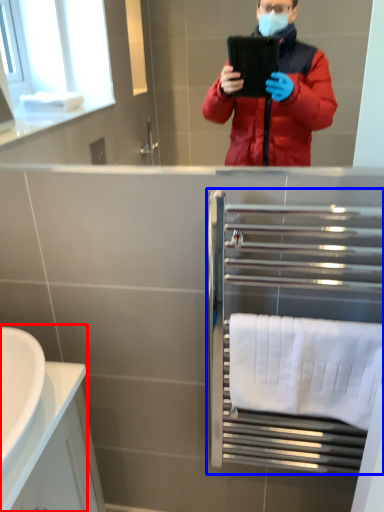
Question: Among these objects, which one is nearest to the camera, sink (highlighted by a red box) or balustrade (highlighted by a blue box)?

Choices:
 (A) sink
 (B) balustrade

Answer: (A)